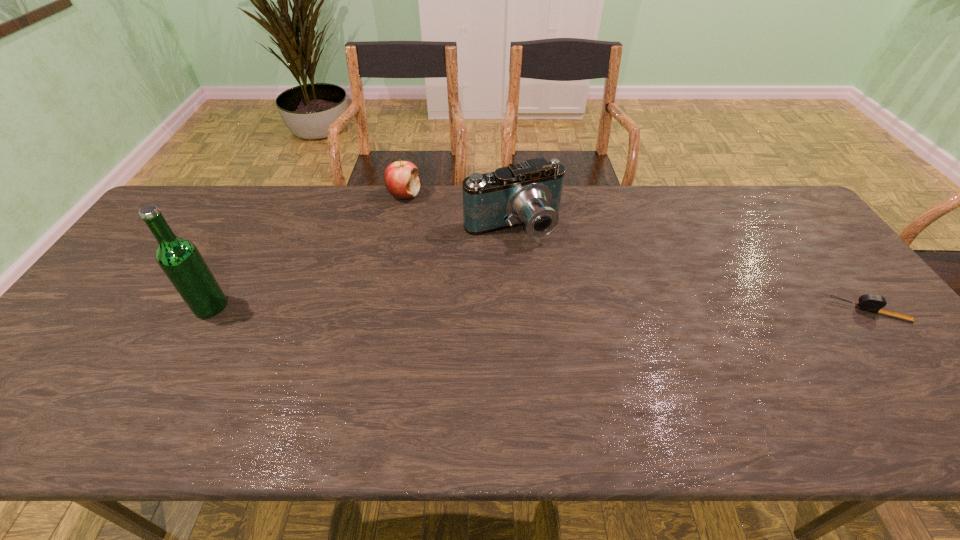
Locate an element on the screen. The height and width of the screenshot is (540, 960). free space at the near edge is located at coordinates (252, 364).

Find the location of `free region at the left edge of the desktop`. free region at the left edge of the desktop is located at coordinates (66, 332).

Where is `free location at the far left corner`? free location at the far left corner is located at coordinates (185, 198).

The height and width of the screenshot is (540, 960). Identify the location of vacant space at the far right corner of the desktop. (755, 209).

Where is `free space between the second object from right to left and the third tallest object`? The width and height of the screenshot is (960, 540). free space between the second object from right to left and the third tallest object is located at coordinates (458, 210).

What are the coordinates of `blank region between the beer bottle and the shortest object` in the screenshot? It's located at (540, 309).

Find the location of a particular element. This screenshot has width=960, height=540. vacant point located between the second tallest object and the leftmost object is located at coordinates (362, 266).

Identify the location of free spot between the leftmost object and the second object from left to right. (307, 251).

Find the location of a particular element. The height and width of the screenshot is (540, 960). vacant space in between the rightmost object and the third object from left to right is located at coordinates (691, 268).

This screenshot has width=960, height=540. I want to click on free space between the rightmost object and the second tallest object, so point(691,268).